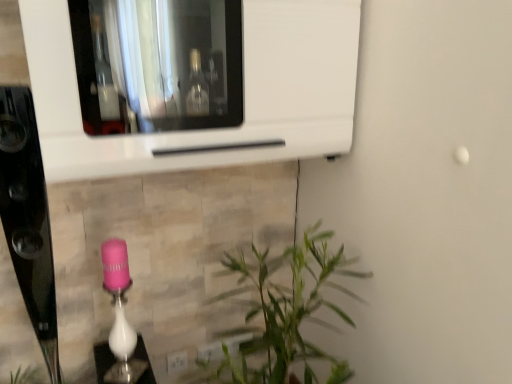
Question: From a real-world perspective, is white plastic electric outlet at lower center located beneath white glossy microwave at upper center?

Choices:
 (A) no
 (B) yes

Answer: (B)

Question: Considering the relative sizes of white plastic electric outlet at lower center and white glossy microwave at upper center in the image provided, is white plastic electric outlet at lower center thinner than white glossy microwave at upper center?

Choices:
 (A) no
 (B) yes

Answer: (B)

Question: Is white plastic electric outlet at lower center to the left of white glossy microwave at upper center from the viewer's perspective?

Choices:
 (A) no
 (B) yes

Answer: (B)

Question: Could you tell me if white plastic electric outlet at lower center is facing white glossy microwave at upper center?

Choices:
 (A) yes
 (B) no

Answer: (B)

Question: Is white plastic electric outlet at lower center bigger than white glossy microwave at upper center?

Choices:
 (A) yes
 (B) no

Answer: (B)

Question: From the image's perspective, is white plastic electric outlet at lower center located beneath white glossy microwave at upper center?

Choices:
 (A) yes
 (B) no

Answer: (A)

Question: Is white glossy microwave at upper center further to the viewer compared to white plastic electric outlet at lower center?

Choices:
 (A) yes
 (B) no

Answer: (B)

Question: From the image's perspective, is white glossy microwave at upper center on top of white plastic electric outlet at lower center?

Choices:
 (A) yes
 (B) no

Answer: (A)

Question: Considering the relative sizes of white glossy microwave at upper center and white plastic electric outlet at lower center in the image provided, is white glossy microwave at upper center smaller than white plastic electric outlet at lower center?

Choices:
 (A) no
 (B) yes

Answer: (A)

Question: Is white glossy microwave at upper center to the left of white plastic electric outlet at lower center from the viewer's perspective?

Choices:
 (A) no
 (B) yes

Answer: (A)

Question: Is white glossy microwave at upper center aimed at white plastic electric outlet at lower center?

Choices:
 (A) no
 (B) yes

Answer: (A)

Question: Is white glossy microwave at upper center not within white plastic electric outlet at lower center?

Choices:
 (A) no
 (B) yes

Answer: (B)

Question: Is white glossy microwave at upper center at the left side of pink glossy lamp at lower center?

Choices:
 (A) no
 (B) yes

Answer: (A)